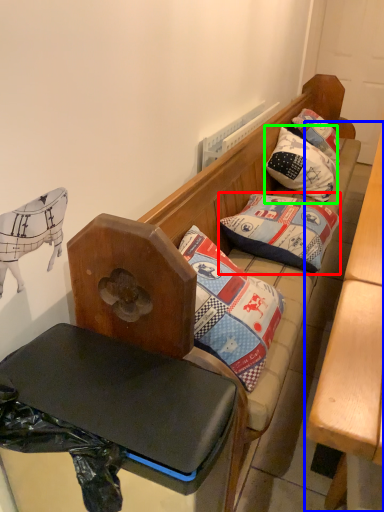
Question: Considering the real-world distances, which object is farthest from pillow (highlighted by a red box)? table (highlighted by a blue box) or pillow (highlighted by a green box)?

Choices:
 (A) table
 (B) pillow

Answer: (B)